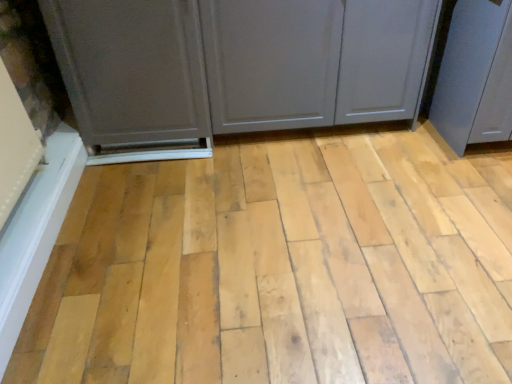
Locate an element on the screen. free space between matte gray cabinet at left, which appears as the second screen door when viewed from the right, and matte gray cupboard at center is located at coordinates [x=285, y=147].